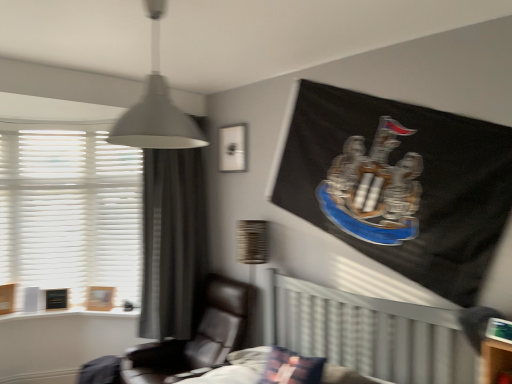
Question: Does black leather chair at center have a greater height compared to white textured blinds at left?

Choices:
 (A) no
 (B) yes

Answer: (A)

Question: From a real-world perspective, does black leather chair at center stand above white textured blinds at left?

Choices:
 (A) yes
 (B) no

Answer: (B)

Question: Does black leather chair at center have a larger size compared to white textured blinds at left?

Choices:
 (A) no
 (B) yes

Answer: (B)

Question: Considering the relative positions of black leather chair at center and white textured blinds at left in the image provided, is black leather chair at center to the right of white textured blinds at left from the viewer's perspective?

Choices:
 (A) yes
 (B) no

Answer: (A)

Question: Is black leather chair at center outside of white textured blinds at left?

Choices:
 (A) no
 (B) yes

Answer: (B)

Question: Visually, is black leather chair at center positioned to the left or to the right of gray fabric curtain at left?

Choices:
 (A) right
 (B) left

Answer: (A)

Question: Considering the positions of point (216, 317) and point (164, 182), is point (216, 317) closer or farther from the camera than point (164, 182)?

Choices:
 (A) farther
 (B) closer

Answer: (B)

Question: From a real-world perspective, is black leather chair at center above or below gray fabric curtain at left?

Choices:
 (A) above
 (B) below

Answer: (B)

Question: Is black leather chair at center spatially inside gray fabric curtain at left, or outside of it?

Choices:
 (A) outside
 (B) inside

Answer: (A)

Question: Do you think white textured blinds at left is within matte white picture frame at upper center, acting as the second picture frame starting from the left, or outside of it?

Choices:
 (A) outside
 (B) inside

Answer: (A)

Question: From the image's perspective, is white textured blinds at left above or below matte white picture frame at upper center, which is counted as the first picture frame, starting from the front?

Choices:
 (A) above
 (B) below

Answer: (B)

Question: Based on their sizes in the image, would you say white textured blinds at left is bigger or smaller than matte white picture frame at upper center, the 1th picture frame positioned from the top?

Choices:
 (A) big
 (B) small

Answer: (A)

Question: Visually, is white textured blinds at left positioned to the left or to the right of matte white picture frame at upper center, positioned as the second picture frame in back-to-front order?

Choices:
 (A) left
 (B) right

Answer: (A)

Question: Is matte white picture frame at upper center, which is counted as the first picture frame, starting from the front, spatially inside plush fabric pillow at center, or outside of it?

Choices:
 (A) outside
 (B) inside

Answer: (A)

Question: Does point (236, 150) appear closer or farther from the camera than point (290, 382)?

Choices:
 (A) closer
 (B) farther

Answer: (B)